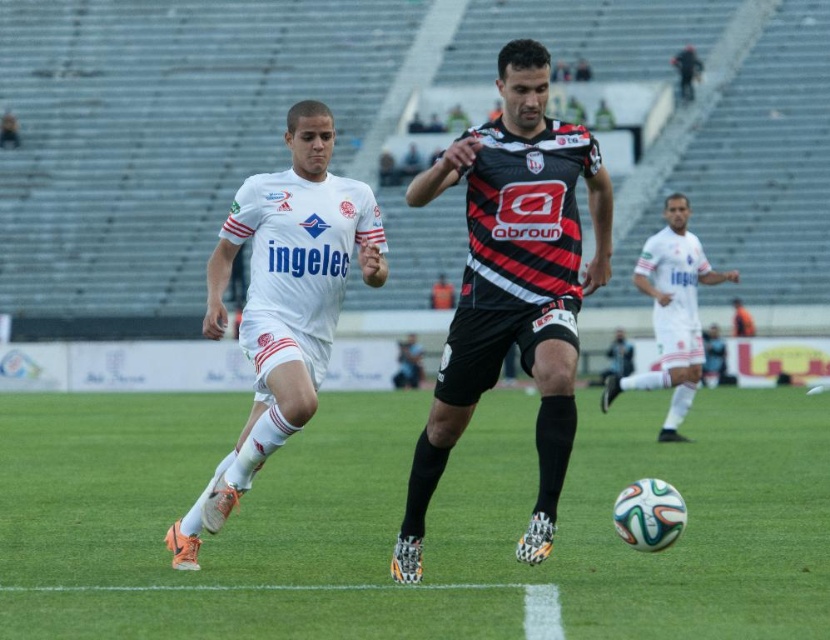
You are a soccer coach analyzing the match. Based on the image, where is the white matte soccer player at center positioned relative to the green grass at center?

The white matte soccer player at center is positioned above the green grass at center, as the green grass at center is located below the white matte soccer player at center.

You are a photographer positioned at the edge of the soccer field. You want to capture a photo of the white matte soccer player at center without the white matte uniform at center blocking the view. Which direction should you move to ensure the soccer player is fully visible?

Move to the right side so that the white matte uniform at center is no longer blocking the view of the white matte soccer player at center.

You are a photographer standing at the edge of the soccer field. You want to take a photo where the green grass at center is in focus while keeping the white matte soccer player at center slightly blurred in the background. Is this possible based on their positions?

The green grass at center is closer to the viewer than the white matte soccer player at center. Since the grass is closer, you can focus on it and have the player slightly blurred in the background.